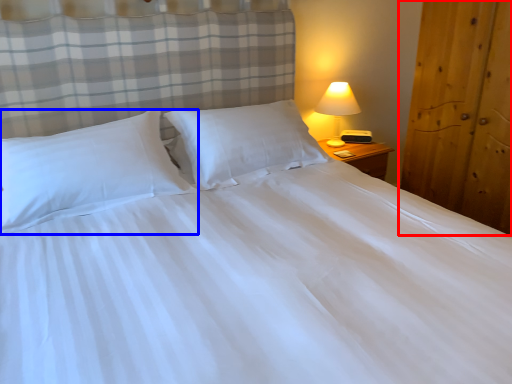
Question: Which object is closer to the camera taking this photo, armoire (highlighted by a red box) or pillow (highlighted by a blue box)?

Choices:
 (A) armoire
 (B) pillow

Answer: (B)